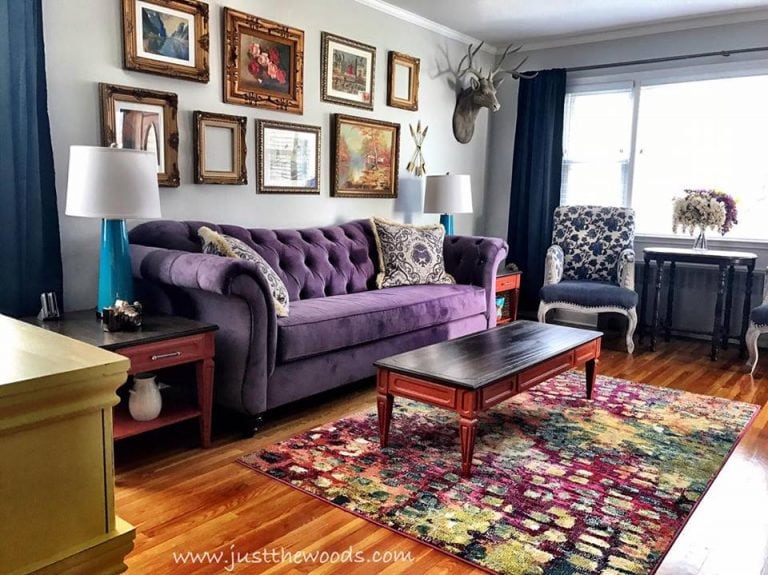
I want to click on white lampshades, so click(x=134, y=178), click(x=452, y=189).